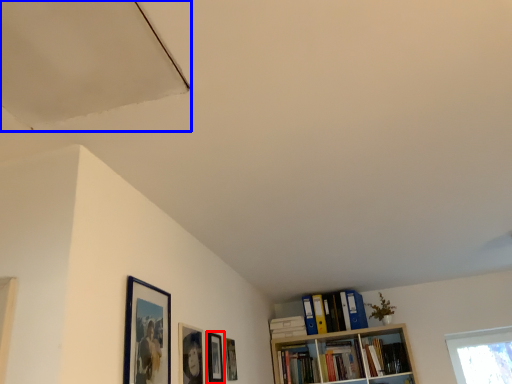
Question: Which of the following is the closest to the observer, picture frame (highlighted by a red box) or exhaust hood (highlighted by a blue box)?

Choices:
 (A) picture frame
 (B) exhaust hood

Answer: (B)